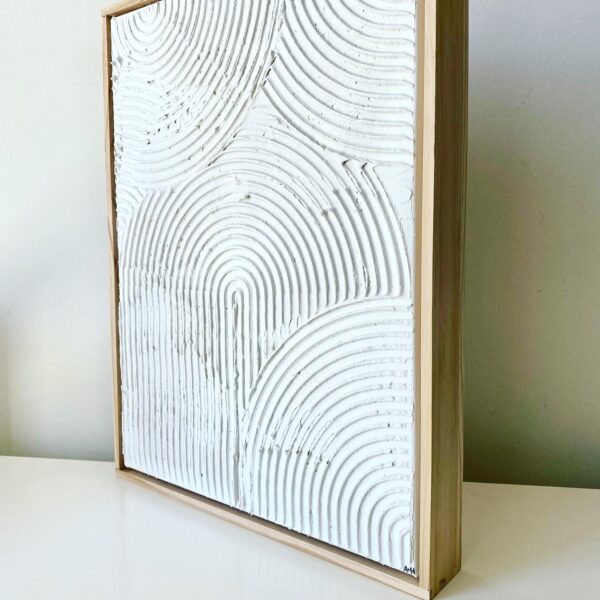
The width and height of the screenshot is (600, 600). What are the coordinates of `wood grain` in the screenshot? It's located at (453, 145), (440, 349), (456, 95).